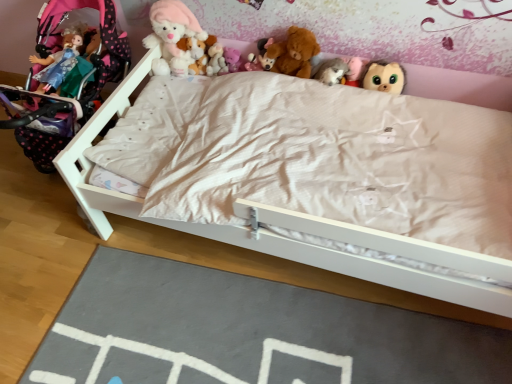
Question: Considering the relative positions of slate at lower center and matte pink teddy bear at upper center, the third toy positioned from the left, in the image provided, is slate at lower center to the right of matte pink teddy bear at upper center, the third toy positioned from the left, from the viewer's perspective?

Choices:
 (A) no
 (B) yes

Answer: (B)

Question: Would you say matte pink teddy bear at upper center, which is the sixth toy from right to left, is part of slate at lower center's contents?

Choices:
 (A) yes
 (B) no

Answer: (B)

Question: Considering the relative sizes of slate at lower center and matte pink teddy bear at upper center, which is the sixth toy from right to left, in the image provided, is slate at lower center smaller than matte pink teddy bear at upper center, which is the sixth toy from right to left,?

Choices:
 (A) no
 (B) yes

Answer: (A)

Question: Is slate at lower center completely or partially outside of matte pink teddy bear at upper center, which is the sixth toy from right to left?

Choices:
 (A) no
 (B) yes

Answer: (B)

Question: Is slate at lower center far away from matte pink teddy bear at upper center, which is the sixth toy from right to left?

Choices:
 (A) yes
 (B) no

Answer: (A)

Question: Considering the relative sizes of slate at lower center and matte pink teddy bear at upper center, which is the sixth toy from right to left, in the image provided, is slate at lower center bigger than matte pink teddy bear at upper center, which is the sixth toy from right to left,?

Choices:
 (A) yes
 (B) no

Answer: (A)

Question: From a real-world perspective, is fluffy plush toys at center, which is the second toy from left to right, over fluffy brown plush at upper center, the eighth toy in the left-to-right sequence?

Choices:
 (A) no
 (B) yes

Answer: (A)

Question: Is fluffy plush toys at center, which is the second toy from left to right, at the left side of fluffy brown plush at upper center, the eighth toy in the left-to-right sequence?

Choices:
 (A) no
 (B) yes

Answer: (B)

Question: Is fluffy plush toys at center, which is counted as the seventh toy, starting from the right, bigger than fluffy brown plush at upper center, the first toy when ordered from right to left?

Choices:
 (A) no
 (B) yes

Answer: (A)

Question: Considering the relative sizes of fluffy plush toys at center, which is the second toy from left to right, and fluffy brown plush at upper center, the first toy when ordered from right to left, in the image provided, is fluffy plush toys at center, which is the second toy from left to right, smaller than fluffy brown plush at upper center, the first toy when ordered from right to left,?

Choices:
 (A) no
 (B) yes

Answer: (B)

Question: Is fluffy plush toys at center, which is the second toy from left to right, positioned beyond the bounds of fluffy brown plush at upper center, the first toy when ordered from right to left?

Choices:
 (A) no
 (B) yes

Answer: (B)

Question: Is fluffy plush toys at center, which is the second toy from left to right, shorter than fluffy brown plush at upper center, the first toy when ordered from right to left?

Choices:
 (A) no
 (B) yes

Answer: (B)

Question: Could you tell me if slate at lower center is turned towards fluffy plush toys at center, which is the second toy from left to right?

Choices:
 (A) no
 (B) yes

Answer: (A)